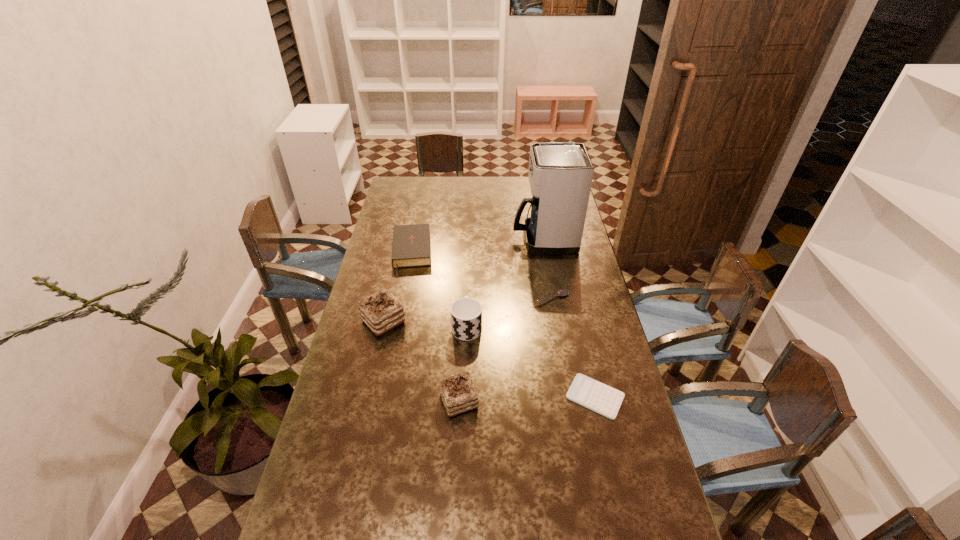
Where is `the farther chocolate cake`? the farther chocolate cake is located at coordinates tap(381, 311).

Locate an element on the screen. The width and height of the screenshot is (960, 540). the taller chocolate cake is located at coordinates (381, 311).

Locate an element on the screen. Image resolution: width=960 pixels, height=540 pixels. the nearer chocolate cake is located at coordinates point(458,393).

Locate an element on the screen. This screenshot has height=540, width=960. the right chocolate cake is located at coordinates point(458,393).

In order to click on the third shortest object in this screenshot , I will do `click(411, 247)`.

This screenshot has height=540, width=960. I want to click on the tallest object, so click(x=560, y=174).

The height and width of the screenshot is (540, 960). In order to click on calculator in this screenshot , I will do `click(594, 395)`.

Image resolution: width=960 pixels, height=540 pixels. What are the coordinates of `soupspoon` in the screenshot? It's located at (562, 292).

The image size is (960, 540). I want to click on cup, so click(x=466, y=313).

Where is `vacant space located 0.370m on the right of the farther chocolate cake`? This screenshot has height=540, width=960. vacant space located 0.370m on the right of the farther chocolate cake is located at coordinates (509, 321).